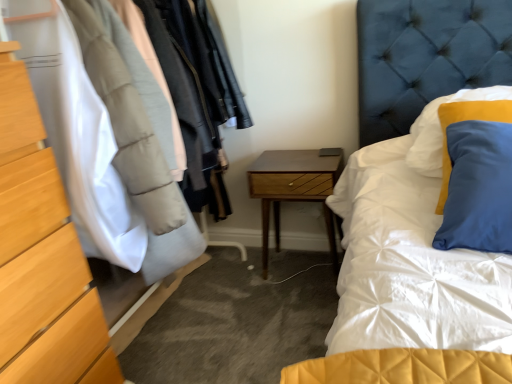
Question: Is wooden dresser at left positioned with its back to woodenmaterial/texturenightstand at center?

Choices:
 (A) yes
 (B) no

Answer: (B)

Question: Is wooden dresser at left not near woodenmaterial/texturenightstand at center?

Choices:
 (A) no
 (B) yes

Answer: (A)

Question: Considering the relative sizes of wooden dresser at left and woodenmaterial/texturenightstand at center in the image provided, is wooden dresser at left wider than woodenmaterial/texturenightstand at center?

Choices:
 (A) no
 (B) yes

Answer: (B)

Question: Can you confirm if wooden dresser at left is positioned to the left of woodenmaterial/texturenightstand at center?

Choices:
 (A) yes
 (B) no

Answer: (A)

Question: Does wooden dresser at left have a lesser width compared to woodenmaterial/texturenightstand at center?

Choices:
 (A) no
 (B) yes

Answer: (A)

Question: In terms of height, does matte wood chest of drawers at left look taller or shorter compared to wooden dresser at left?

Choices:
 (A) short
 (B) tall

Answer: (A)

Question: From the image's perspective, is matte wood chest of drawers at left positioned above or below wooden dresser at left?

Choices:
 (A) above
 (B) below

Answer: (B)

Question: Based on their sizes in the image, would you say matte wood chest of drawers at left is bigger or smaller than wooden dresser at left?

Choices:
 (A) small
 (B) big

Answer: (A)

Question: From a real-world perspective, is matte wood chest of drawers at left physically located above or below wooden dresser at left?

Choices:
 (A) above
 (B) below

Answer: (B)

Question: Considering their positions, is woodenmaterial/texturenightstand at center located in front of or behind matte wood chest of drawers at left?

Choices:
 (A) front
 (B) behind

Answer: (B)

Question: From a real-world perspective, is woodenmaterial/texturenightstand at center above or below matte wood chest of drawers at left?

Choices:
 (A) above
 (B) below

Answer: (B)

Question: Is woodenmaterial/texturenightstand at center bigger or smaller than matte wood chest of drawers at left?

Choices:
 (A) big
 (B) small

Answer: (B)

Question: Is woodenmaterial/texturenightstand at center spatially inside matte wood chest of drawers at left, or outside of it?

Choices:
 (A) outside
 (B) inside

Answer: (A)

Question: Relative to woodenmaterial/texturenightstand at center, is wooden dresser at left in front or behind?

Choices:
 (A) behind
 (B) front

Answer: (B)

Question: Which is correct: wooden dresser at left is inside woodenmaterial/texturenightstand at center, or outside of it?

Choices:
 (A) outside
 (B) inside

Answer: (A)